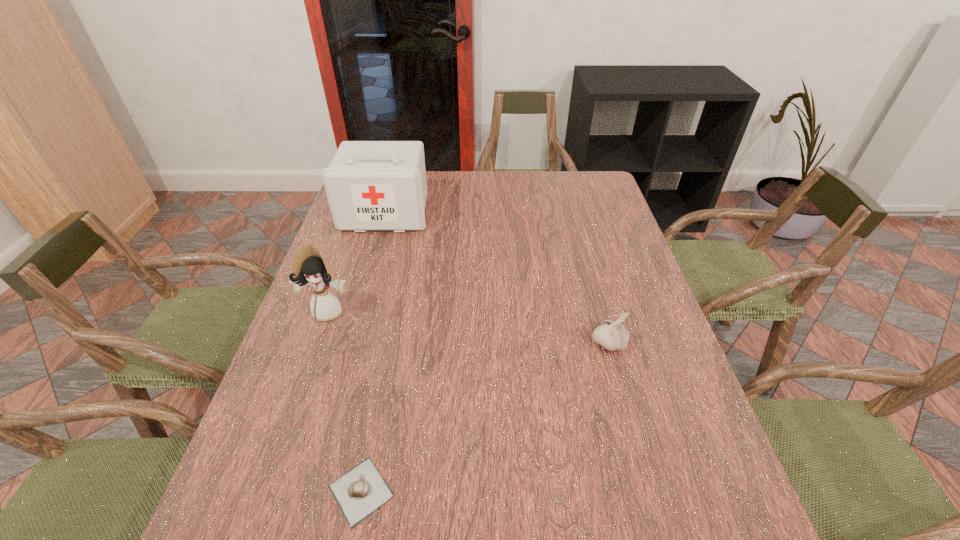
Identify the location of vacant space that satisfies the following two spatial constraints: 1. at the front face of the nearer garlic; 2. on the left side of the doll. (265, 491).